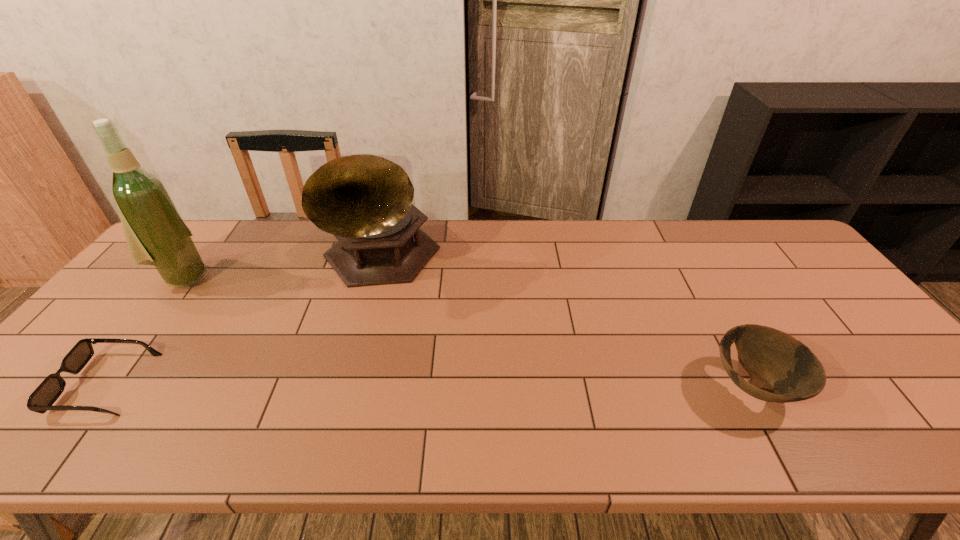
Locate an element on the screen. The width and height of the screenshot is (960, 540). vacant space on the desktop that is between the shortest object and the bowl and is positioned on the front-facing side of the tallest object is located at coordinates (348, 385).

The width and height of the screenshot is (960, 540). Find the location of `free spot on the desktop that is between the shortest object and the third tallest object and is positioned on the horn direction of the third shortest object`. free spot on the desktop that is between the shortest object and the third tallest object and is positioned on the horn direction of the third shortest object is located at coordinates (492, 386).